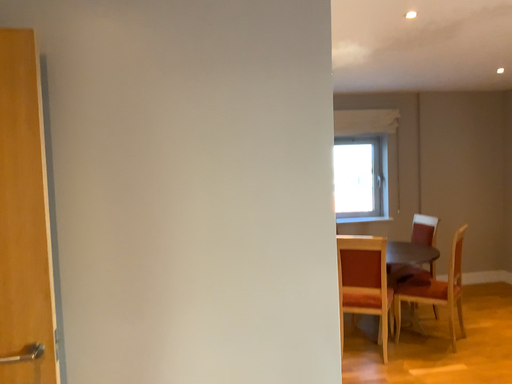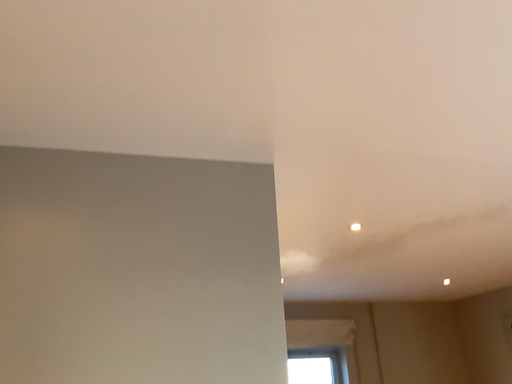
Question: Which way did the camera rotate in the video?

Choices:
 (A) rotated downward
 (B) rotated upward

Answer: (B)